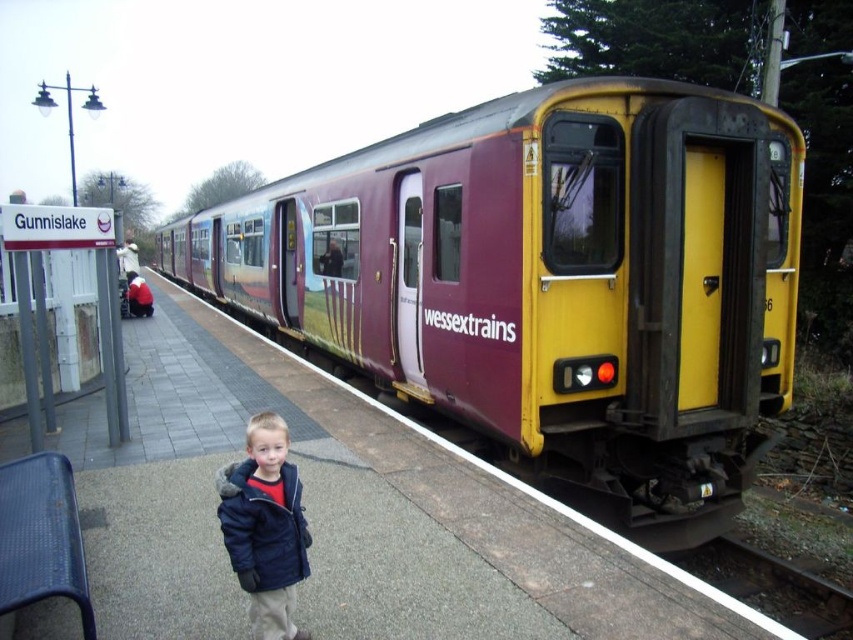
Question: Does dark blue fleece jacket at center come behind metal/smooth train track at lower right?

Choices:
 (A) no
 (B) yes

Answer: (A)

Question: Which point is closer to the camera?

Choices:
 (A) dark blue fleece jacket at center
 (B) metal/smooth train track at lower right

Answer: (A)

Question: Estimate the real-world distances between objects in this image. Which object is farther from the maroon/yellow metal train at center?

Choices:
 (A) dark blue fleece jacket at center
 (B) metal/smooth train track at lower right

Answer: (A)

Question: Considering the relative positions of dark blue fleece jacket at center and metal/smooth train track at lower right in the image provided, where is dark blue fleece jacket at center located with respect to metal/smooth train track at lower right?

Choices:
 (A) below
 (B) above

Answer: (B)

Question: Is dark blue fleece jacket at center wider than metal/smooth train track at lower right?

Choices:
 (A) yes
 (B) no

Answer: (B)

Question: Estimate the real-world distances between objects in this image. Which object is farther from the dark blue fleece jacket at center?

Choices:
 (A) maroon/yellow metal train at center
 (B) metal/smooth train track at lower right

Answer: (A)